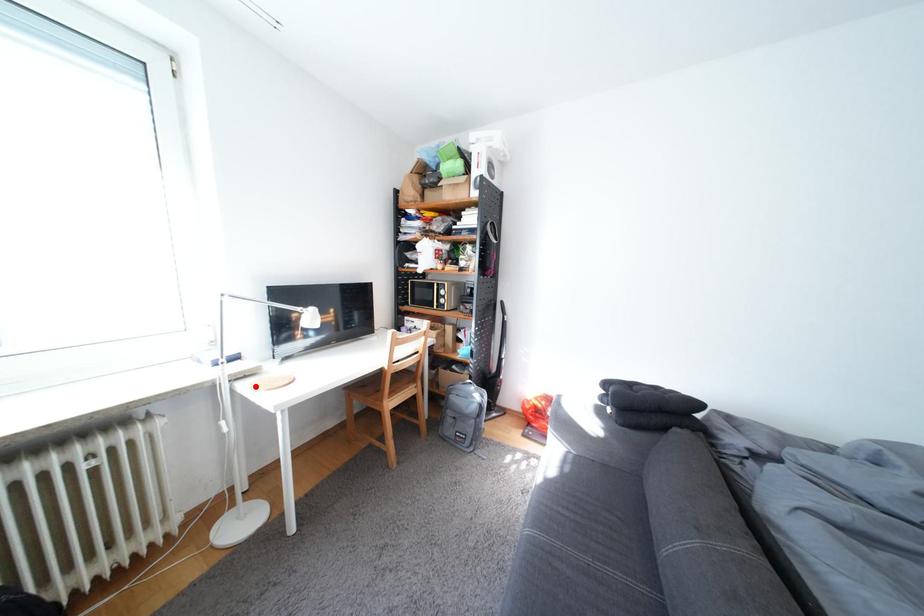
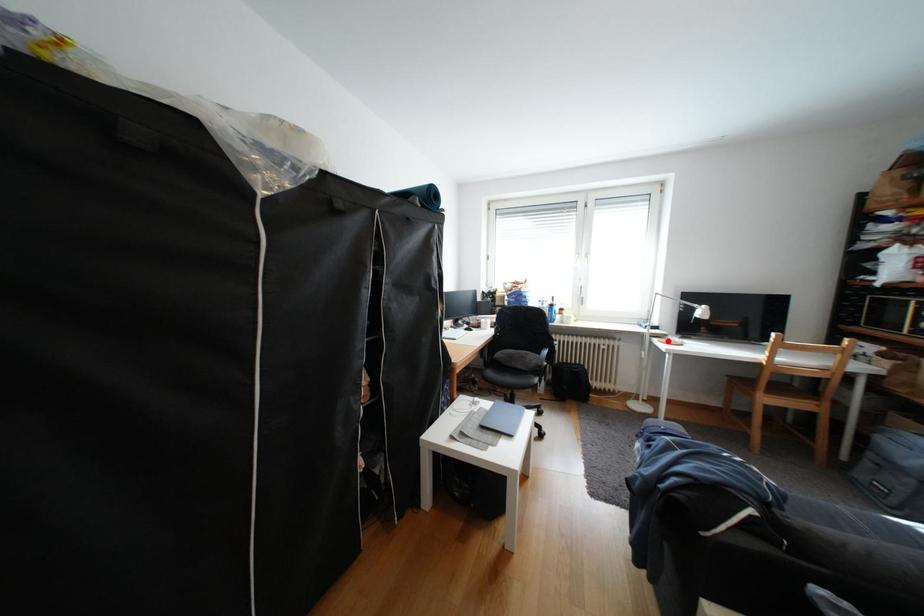
I am providing you with two images of the same scene from different viewpoints. A red point is marked on the first image and another point is marked on the second image. Is the red point in image1 aligned with the point shown in image2?

Yes